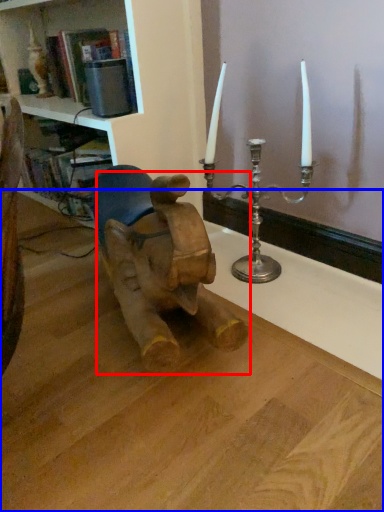
Question: Which point is further to the camera, baby elephant (highlighted by a red box) or table (highlighted by a blue box)?

Choices:
 (A) baby elephant
 (B) table

Answer: (A)